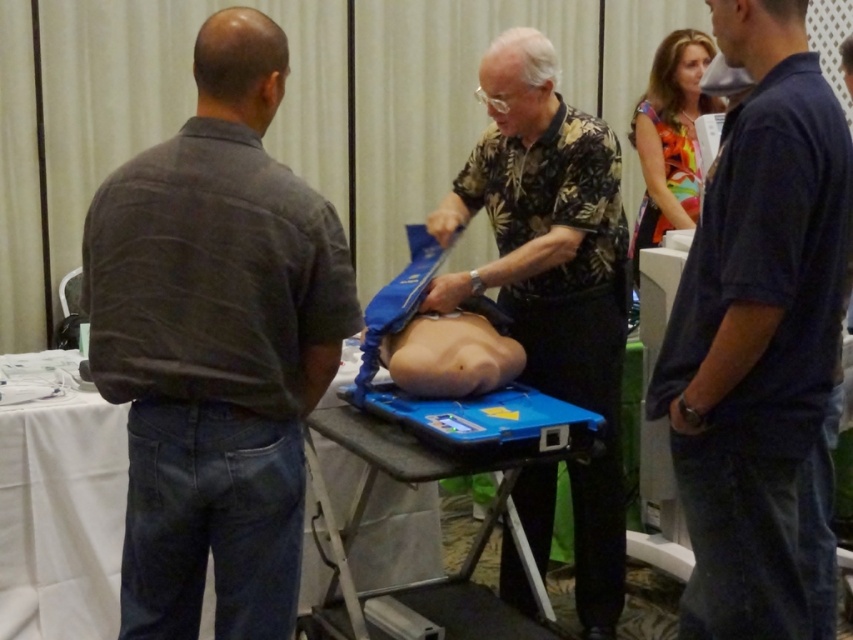
You are a medical student observing a procedure. You notice the dark blue shirt at right and the smooth skin at center. Which object is positioned higher in the image?

The dark blue shirt at right is above smooth skin at center, so the dark blue shirt at right is positioned higher in the image.

You are a medical student who needs to hand a tool to the person in the dark blue shirt at right. You are currently standing 1.47 meters away from them. If the tool you need to hand them is 1 meter long, can you reach them without moving closer?

The distance between you and the person in the dark blue shirt at right is 1.47 meters. Since the tool is only 1 meter long, you cannot reach them without moving closer as the tool is shorter than the distance between you.